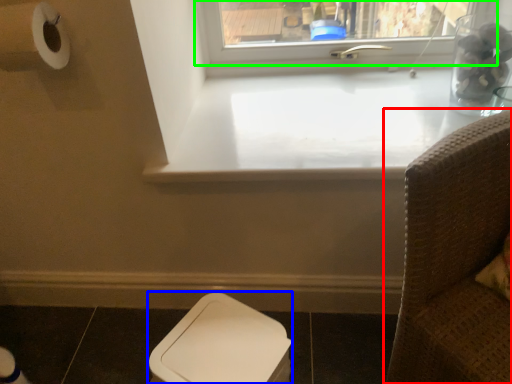
Question: Considering the real-world distances, which object is closest to furniture (highlighted by a red box)? toilet bowl (highlighted by a blue box) or window (highlighted by a green box).

Choices:
 (A) toilet bowl
 (B) window

Answer: (A)